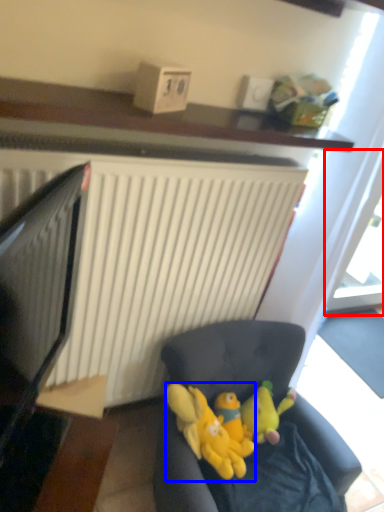
Question: Which object appears farthest to the camera in this image, glass door (highlighted by a red box) or toy (highlighted by a blue box)?

Choices:
 (A) glass door
 (B) toy

Answer: (A)